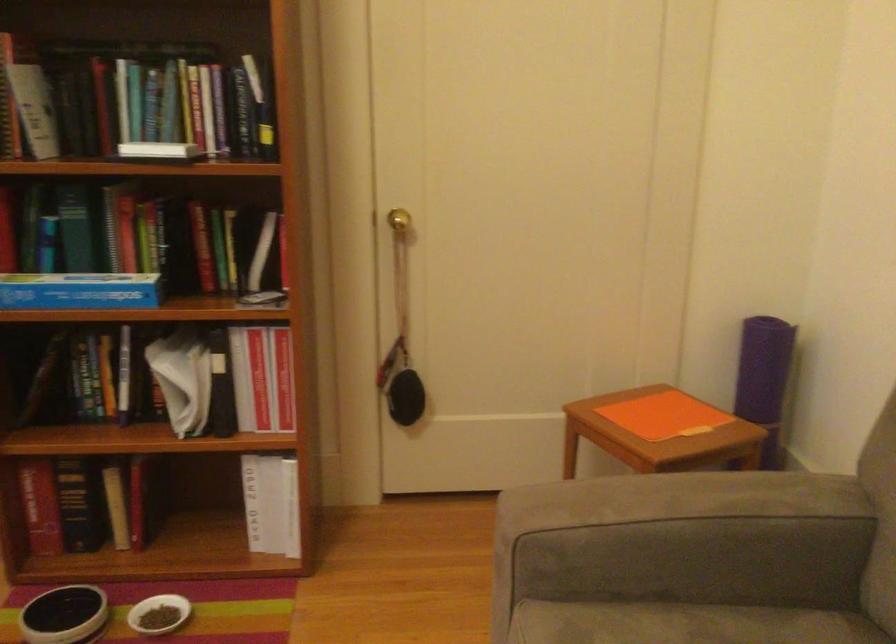
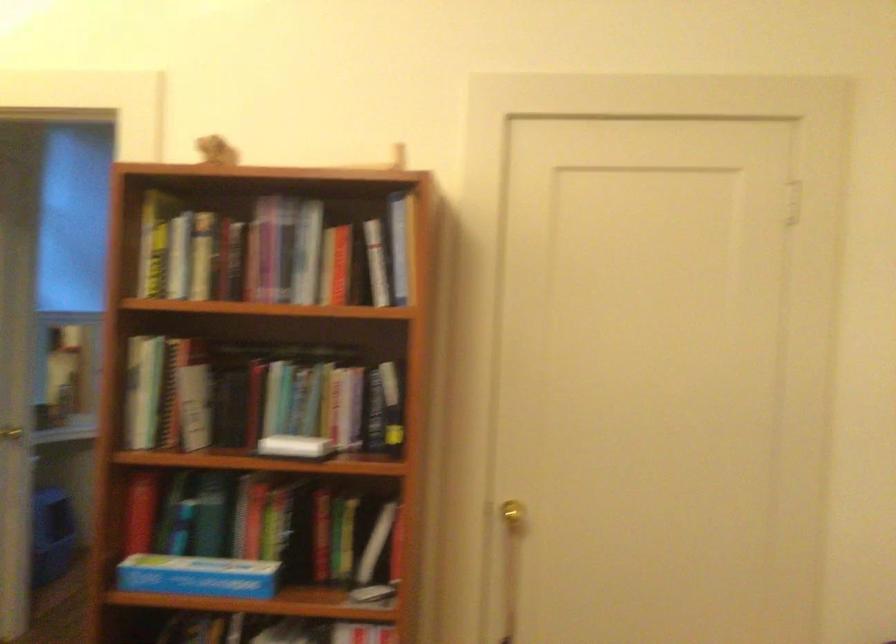
Where in the second image is the point corresponding to point (73, 292) from the first image?

(197, 576)